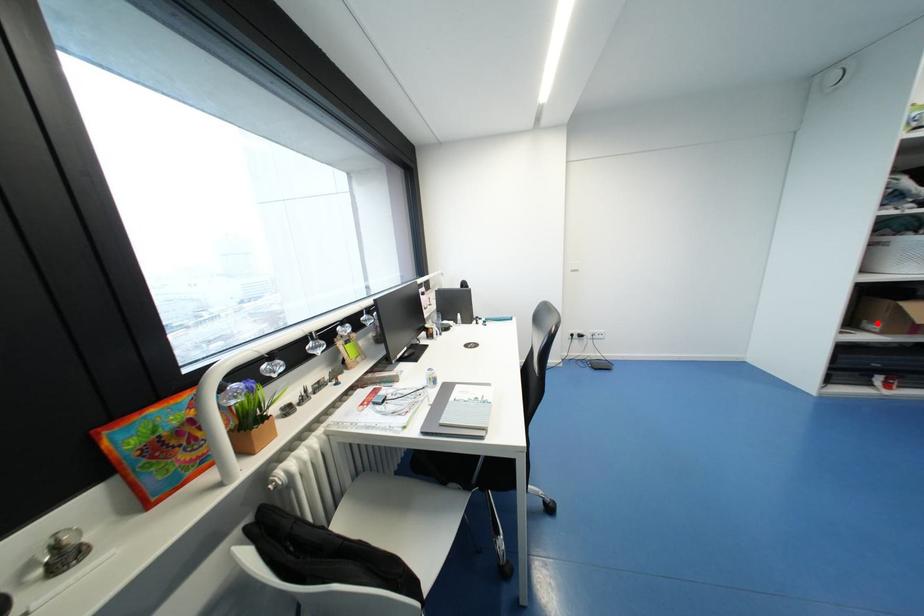
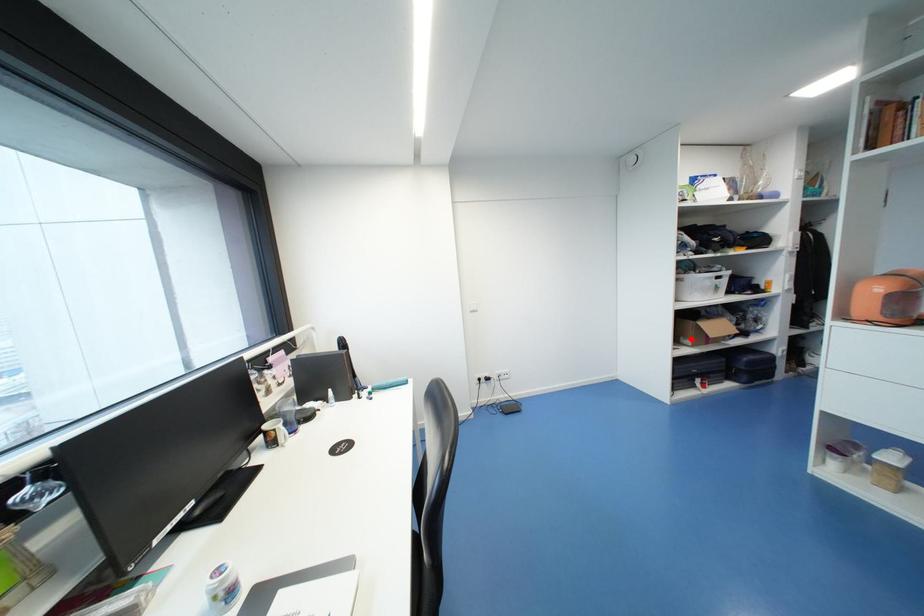
I am providing you with two images of the same scene from different viewpoints. A red point is marked on the first image and another point is marked on the second image. Is the marked point in image1 the same physical position as the marked point in image2?

Yes